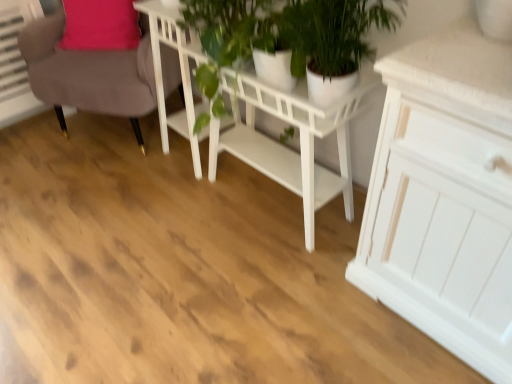
The width and height of the screenshot is (512, 384). I want to click on free region under white glossy table at center, the 2th table viewed from the left (from a real-world perspective), so [269, 200].